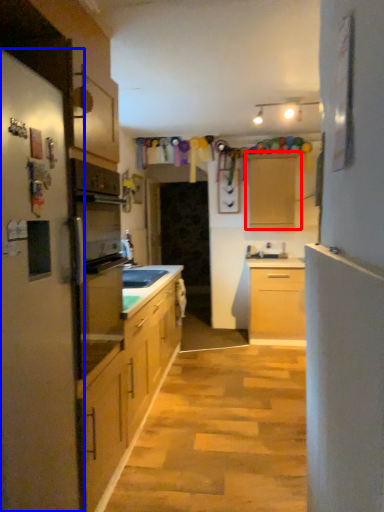
Question: Among these objects, which one is farthest to the camera, cabinetry (highlighted by a red box) or fridge (highlighted by a blue box)?

Choices:
 (A) cabinetry
 (B) fridge

Answer: (A)